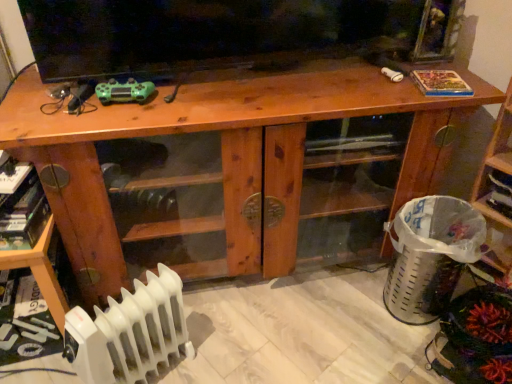
You are a GUI agent. You are given a task and a screenshot of the screen. Output one action in this format:
    pyautogui.click(x=<x>, y=<y>)
    Task: Click on the free spot in front of matte black tv at upper center
    
    Given the screenshot: What is the action you would take?
    pyautogui.click(x=227, y=99)